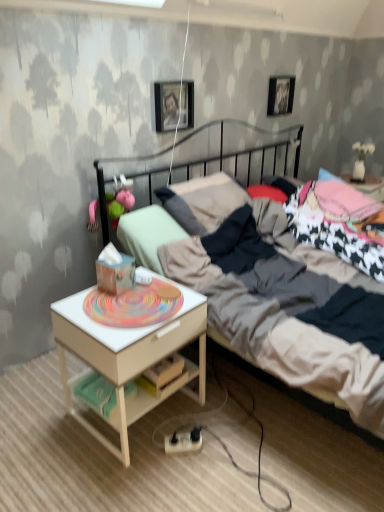
Question: From the image's perspective, is dark gray metal bed at center over metallic silver picture frame at upper center, which is the second picture frame in left-to-right order?

Choices:
 (A) no
 (B) yes

Answer: (A)

Question: Is dark gray metal bed at center at the left side of metallic silver picture frame at upper center, the 1th picture frame from the top?

Choices:
 (A) no
 (B) yes

Answer: (A)

Question: From a real-world perspective, is dark gray metal bed at center under metallic silver picture frame at upper center, which is the 2th picture frame in front-to-back order?

Choices:
 (A) yes
 (B) no

Answer: (A)

Question: Considering the relative positions of dark gray metal bed at center and metallic silver picture frame at upper center, marked as the 2th picture frame in a bottom-to-top arrangement, in the image provided, is dark gray metal bed at center to the right of metallic silver picture frame at upper center, marked as the 2th picture frame in a bottom-to-top arrangement, from the viewer's perspective?

Choices:
 (A) no
 (B) yes

Answer: (B)

Question: Is dark gray metal bed at center behind metallic silver picture frame at upper center, which is the 2th picture frame in front-to-back order?

Choices:
 (A) yes
 (B) no

Answer: (B)

Question: Is dark gray metal bed at center outside of metallic silver picture frame at upper center, the 1th picture frame from the top?

Choices:
 (A) no
 (B) yes

Answer: (B)

Question: Can you confirm if metallic silver picture frame at upper center, marked as the 2th picture frame in a bottom-to-top arrangement, is taller than pink fabric toy at left?

Choices:
 (A) yes
 (B) no

Answer: (A)

Question: Is pink fabric toy at left a part of metallic silver picture frame at upper center, which is the 2th picture frame in front-to-back order?

Choices:
 (A) no
 (B) yes

Answer: (A)

Question: Is metallic silver picture frame at upper center, the 1th picture frame from the top, outside of pink fabric toy at left?

Choices:
 (A) no
 (B) yes

Answer: (B)

Question: Does metallic silver picture frame at upper center, arranged as the first picture frame when viewed from the right, appear on the right side of pink fabric toy at left?

Choices:
 (A) yes
 (B) no

Answer: (A)

Question: Are metallic silver picture frame at upper center, the 1th picture frame from the top, and pink fabric toy at left located far from each other?

Choices:
 (A) yes
 (B) no

Answer: (A)

Question: Can you confirm if metallic silver picture frame at upper center, which appears as the first picture frame when viewed from the back, is wider than pink fabric toy at left?

Choices:
 (A) no
 (B) yes

Answer: (A)

Question: Considering the relative positions of metallic photo frame at upper center, the first picture frame in the bottom-to-top sequence, and metallic silver picture frame at upper center, the 1th picture frame from the top, in the image provided, is metallic photo frame at upper center, the first picture frame in the bottom-to-top sequence, to the right of metallic silver picture frame at upper center, the 1th picture frame from the top, from the viewer's perspective?

Choices:
 (A) yes
 (B) no

Answer: (B)